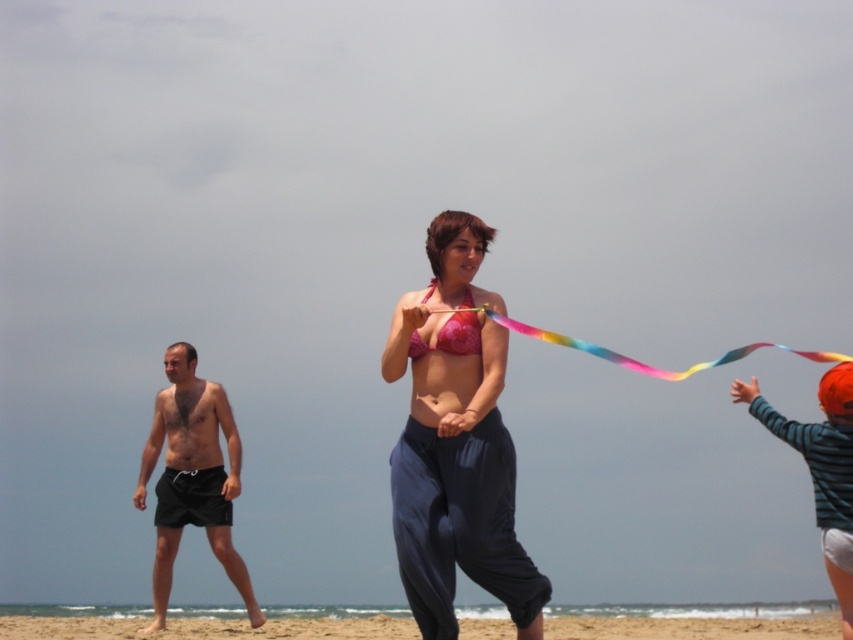
Question: Does sandy beach at lower center have a lesser width compared to striped cotton shirt at right?

Choices:
 (A) yes
 (B) no

Answer: (B)

Question: Estimate the real-world distances between objects in this image. Which object is closer to the striped cotton shirt at right?

Choices:
 (A) pink fabric bikini top at center
 (B) rainbow fabric ribbon at center
 (C) sandy beach at lower center

Answer: (B)

Question: Is pink fabric bikini top at center to the left of striped cotton shirt at right from the viewer's perspective?

Choices:
 (A) no
 (B) yes

Answer: (B)

Question: Can you confirm if sandy beach at lower center is bigger than striped cotton shirt at right?

Choices:
 (A) yes
 (B) no

Answer: (A)

Question: Which of the following is the closest to the observer?

Choices:
 (A) (434, 588)
 (B) (189, 448)
 (C) (831, 358)
 (D) (820, 380)

Answer: (A)

Question: Based on their relative distances, which object is farther from the sandy beach at lower center?

Choices:
 (A) pink fabric bikini top at center
 (B) striped cotton shirt at right
 (C) black fabric shorts at left

Answer: (A)